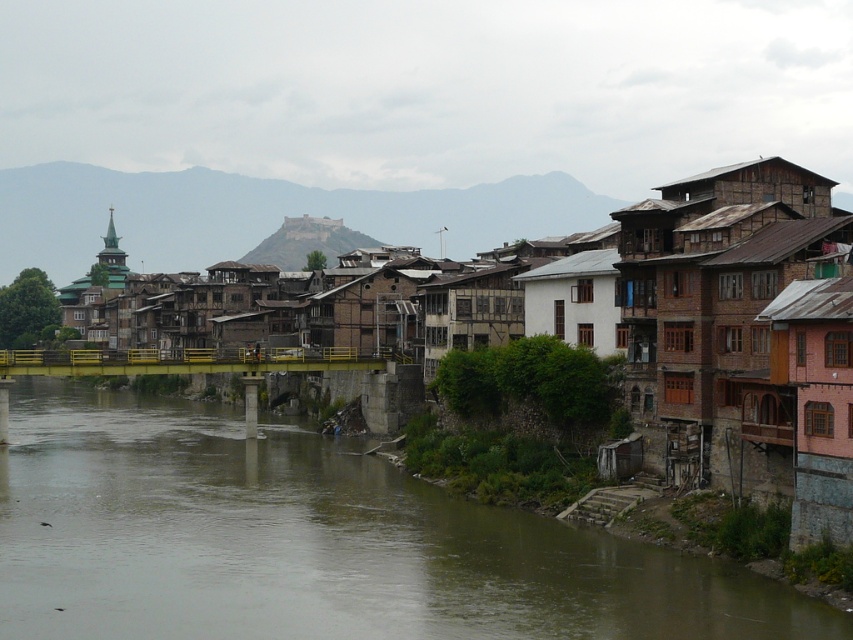
Can you confirm if brown wooden houses at center is positioned to the left of white wooden house at center?

Indeed, brown wooden houses at center is positioned on the left side of white wooden house at center.

How far apart are brown wooden houses at center and white wooden house at center?

brown wooden houses at center is 25.59 feet from white wooden house at center.

Which is in front, point (703, 284) or point (548, 285)?

Point (703, 284) is more forward.

The width and height of the screenshot is (853, 640). I want to click on brown wooden houses at center, so click(738, 332).

Which of these two, brown concrete river at lower left or white wooden house at center, stands taller?

white wooden house at center

Is point (506, 538) in front of point (596, 305)?

That is True.

This screenshot has width=853, height=640. Find the location of `brown concrete river at lower left`. brown concrete river at lower left is located at coordinates (314, 541).

What do you see at coordinates (314, 541) in the screenshot?
I see `brown concrete river at lower left` at bounding box center [314, 541].

Does brown concrete river at lower left have a greater width compared to brown wooden houses at center?

Yes.

The image size is (853, 640). In order to click on brown concrete river at lower left in this screenshot , I will do `click(314, 541)`.